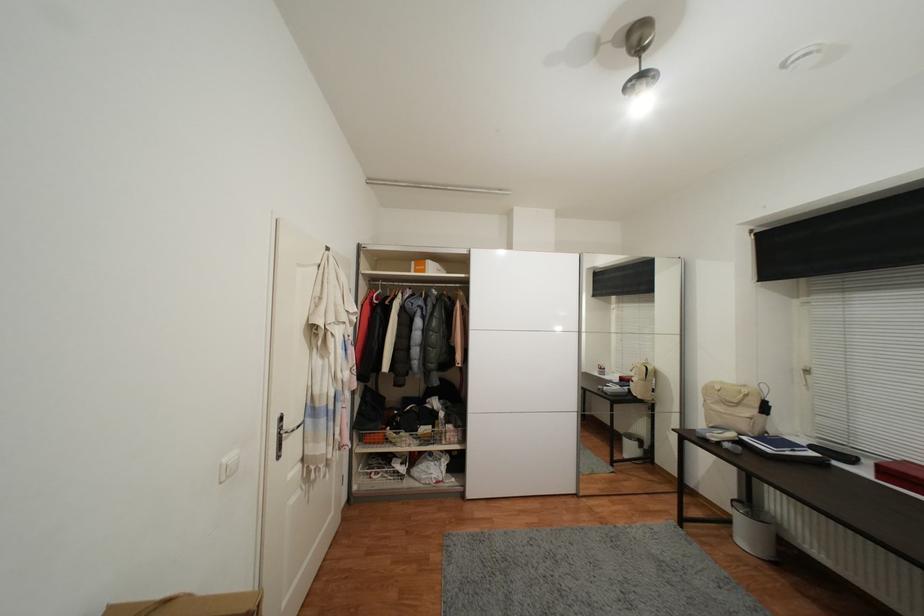
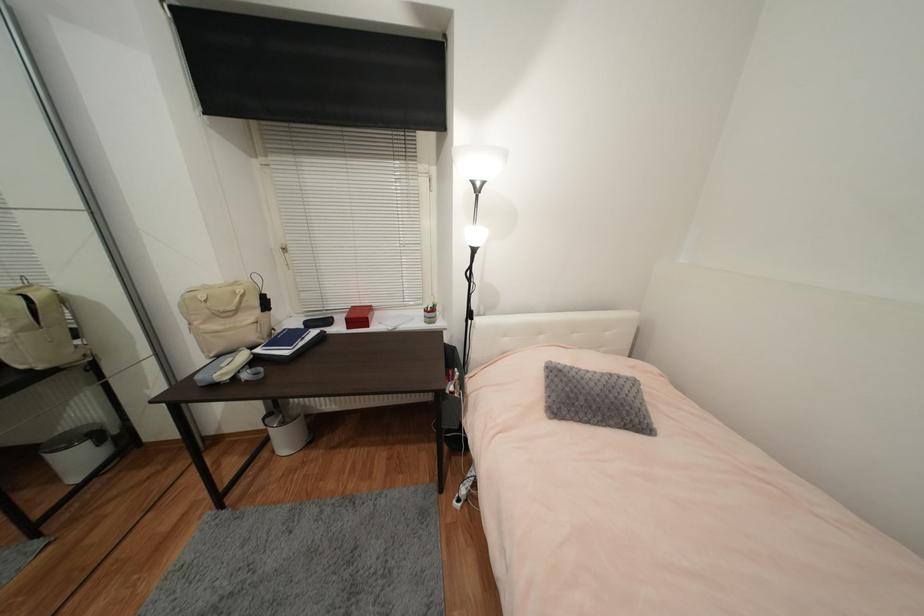
Find the pixel in the second image that matches point (794, 454) in the first image.

(306, 344)